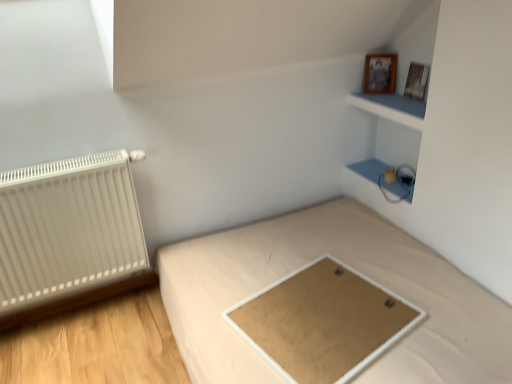
Question: Considering the relative positions of wooden picture frame at upper right, which is the 1th picture frame from right to left, and matte white cabinet at upper right, the second cabinet in the top-to-bottom sequence, in the image provided, is wooden picture frame at upper right, which is the 1th picture frame from right to left, to the left of matte white cabinet at upper right, the second cabinet in the top-to-bottom sequence, from the viewer's perspective?

Choices:
 (A) yes
 (B) no

Answer: (B)

Question: Is wooden picture frame at upper right, which is the 1th picture frame from right to left, to the right of matte white cabinet at upper right, which is counted as the first cabinet, starting from the bottom, from the viewer's perspective?

Choices:
 (A) yes
 (B) no

Answer: (A)

Question: Is wooden picture frame at upper right, which is the 1th picture frame from right to left, next to matte white cabinet at upper right, which is counted as the first cabinet, starting from the bottom?

Choices:
 (A) no
 (B) yes

Answer: (A)

Question: Does wooden picture frame at upper right, which is the 1th picture frame from right to left, have a greater width compared to matte white cabinet at upper right, which is counted as the first cabinet, starting from the bottom?

Choices:
 (A) no
 (B) yes

Answer: (A)

Question: Is wooden picture frame at upper right, which is the 1th picture frame from right to left, outside of matte white cabinet at upper right, the second cabinet in the top-to-bottom sequence?

Choices:
 (A) yes
 (B) no

Answer: (A)

Question: Is wooden picture frame at upper right, which is the 1th picture frame from right to left, spatially inside wooden photo frame at upper right, marked as the 2th picture frame in a right-to-left arrangement, or outside of it?

Choices:
 (A) outside
 (B) inside

Answer: (A)

Question: From the image's perspective, is wooden picture frame at upper right, which is the 1th picture frame from right to left, positioned above or below wooden photo frame at upper right, marked as the 1th picture frame in a left-to-right arrangement?

Choices:
 (A) above
 (B) below

Answer: (B)

Question: Is wooden picture frame at upper right, placed as the 2th picture frame when sorted from left to right, in front of or behind wooden photo frame at upper right, marked as the 1th picture frame in a left-to-right arrangement, in the image?

Choices:
 (A) behind
 (B) front

Answer: (B)

Question: Is point (416, 87) closer or farther from the camera than point (365, 89)?

Choices:
 (A) farther
 (B) closer

Answer: (B)

Question: Is light brown fabric bed at center wider or thinner than matte white cabinet at upper right, the second cabinet in the top-to-bottom sequence?

Choices:
 (A) thin
 (B) wide

Answer: (B)

Question: From the image's perspective, is light brown fabric bed at center positioned above or below matte white cabinet at upper right, the second cabinet in the top-to-bottom sequence?

Choices:
 (A) below
 (B) above

Answer: (A)

Question: Looking at the image, does light brown fabric bed at center seem bigger or smaller compared to matte white cabinet at upper right, which is counted as the first cabinet, starting from the bottom?

Choices:
 (A) small
 (B) big

Answer: (B)

Question: Is point (234, 301) positioned closer to the camera than point (381, 165)?

Choices:
 (A) farther
 (B) closer

Answer: (B)

Question: From their relative heights in the image, would you say white matte radiator at left is taller or shorter than matte white cabinet at upper right, the second cabinet in the top-to-bottom sequence?

Choices:
 (A) short
 (B) tall

Answer: (B)

Question: In terms of width, does white matte radiator at left look wider or thinner when compared to matte white cabinet at upper right, which is counted as the first cabinet, starting from the bottom?

Choices:
 (A) thin
 (B) wide

Answer: (A)